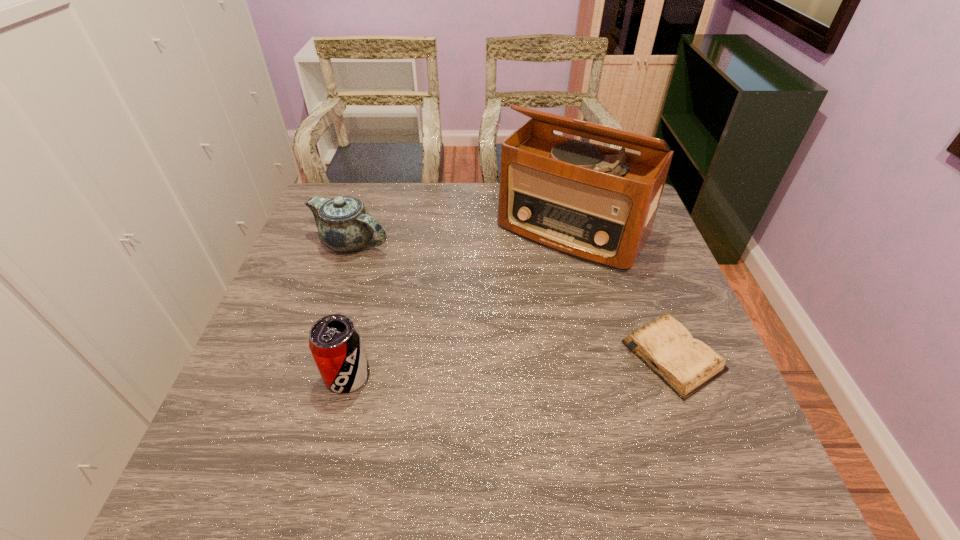
Where is `free area in between the chinaware and the shortest object`? free area in between the chinaware and the shortest object is located at coordinates (513, 300).

Locate an element on the screen. The height and width of the screenshot is (540, 960). object that is the third closest to the soda can is located at coordinates (686, 364).

Select which object is the third closest to the soda can. Please provide its 2D coordinates. Your answer should be formatted as a tuple, i.e. [(x, y)], where the tuple contains the x and y coordinates of a point satisfying the conditions above.

[(686, 364)]

Identify the location of free space that satisfies the following two spatial constraints: 1. on the back side of the chinaware; 2. on the left side of the tallest object. The width and height of the screenshot is (960, 540). click(x=356, y=230).

Find the location of a particular element. free region that satisfies the following two spatial constraints: 1. on the back side of the chinaware; 2. on the right side of the radio receiver is located at coordinates (356, 230).

Where is `blank area in the image that satisfies the following two spatial constraints: 1. on the front side of the diary; 2. on the right side of the chinaware`? Image resolution: width=960 pixels, height=540 pixels. blank area in the image that satisfies the following two spatial constraints: 1. on the front side of the diary; 2. on the right side of the chinaware is located at coordinates (314, 356).

Image resolution: width=960 pixels, height=540 pixels. Identify the location of vacant space that satisfies the following two spatial constraints: 1. on the back side of the tallest object; 2. on the right side of the soda can. (385, 230).

The width and height of the screenshot is (960, 540). Identify the location of free space that satisfies the following two spatial constraints: 1. on the back side of the radio receiver; 2. on the left side of the chinaware. (356, 230).